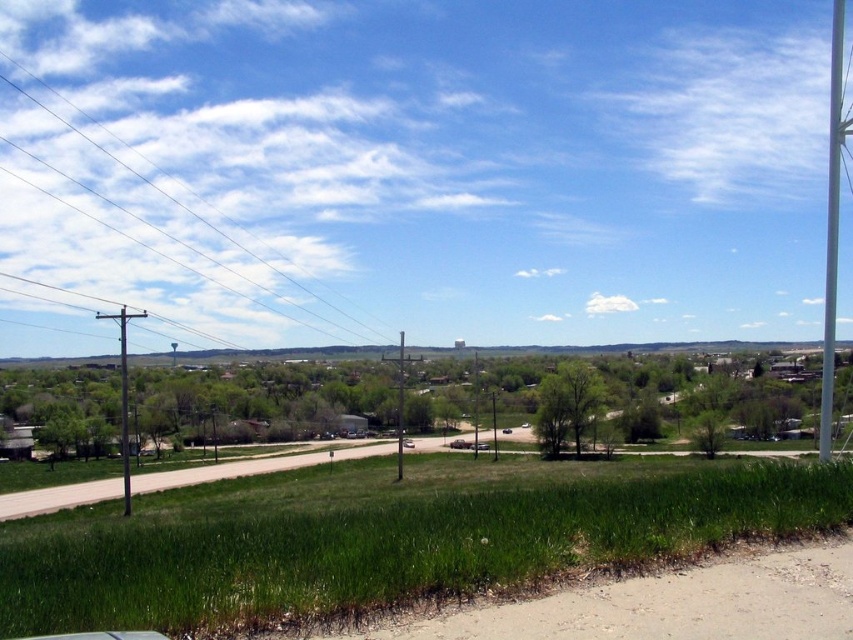
You are a surveyor measuring distances between structures in the rural landscape. You need to determine if the distance between the metallic gray utility pole at left and the black metal pole at center is sufficient for installing a new communication cable that requires a minimum of 30 meters. Can you confirm if the distance meets the requirement?

The metallic gray utility pole at left and the black metal pole at center are 35.08 meters apart, which exceeds the minimum requirement of 30 meters. Therefore, the distance is sufficient for installing the new communication cable.

You are standing at the bottom right corner of the image where the dirt road is. Looking towards the upper left corner, can you see the smooth wire at upper left? Please explain based on the scene description.

Yes, the smooth wire at upper left is located at point (183, 205) in the 2D image, which is within the upper left area of the frame. Since there are no obstructions mentioned between the dirt road at bottom right and the upper left corner, the smooth wire at upper left should be visible from that vantage point.